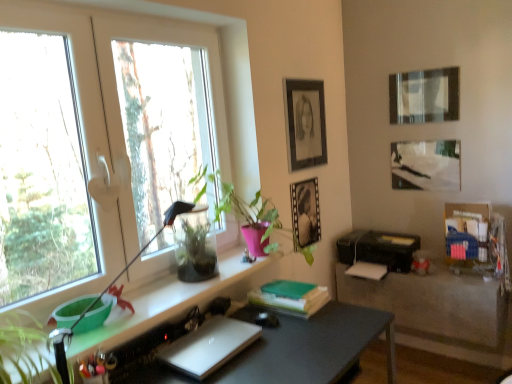
Question: In the image, is matte black picture frame at upper right, arranged as the 3th picture frame when viewed from the left, on the left side or the right side of matte gray desk at center?

Choices:
 (A) left
 (B) right

Answer: (B)

Question: Is point (457, 82) positioned closer to the camera than point (362, 317)?

Choices:
 (A) closer
 (B) farther

Answer: (B)

Question: Estimate the real-world distances between objects in this image. Which object is closer to the translucent glass shelf at left?

Choices:
 (A) green matte book at center
 (B) black plastic printer at lower right
 (C) green glossy plant at center
 (D) transparent glass window at upper left
 (E) transparent glass vase at window

Answer: (E)

Question: Considering the real-world distances, which object is farthest from the matte black picture frame at upper right, which is the second picture frame in right-to-left order?

Choices:
 (A) sleek silver laptop at center
 (B) matte black table at lower right
 (C) metallic silver picture frame at center, the second picture frame from the left
 (D) matte black picture frame at upper center, which ranks as the first picture frame in left-to-right order
 (E) green glossy plant at center

Answer: (A)